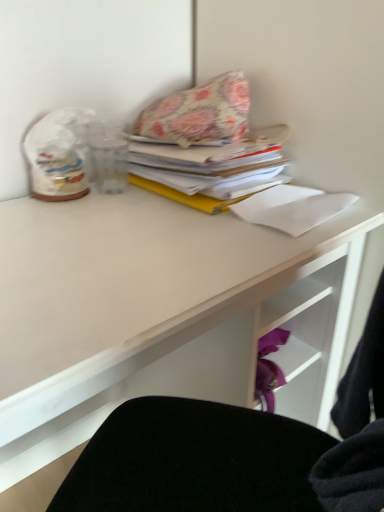
You are a GUI agent. You are given a task and a screenshot of the screen. Output one action in this format:
    pyautogui.click(x=<x>, y=<y>)
    Task: Click on the free space in front of white paper at upper right
    This screenshot has height=512, width=384.
    Given the screenshot: What is the action you would take?
    pyautogui.click(x=268, y=254)